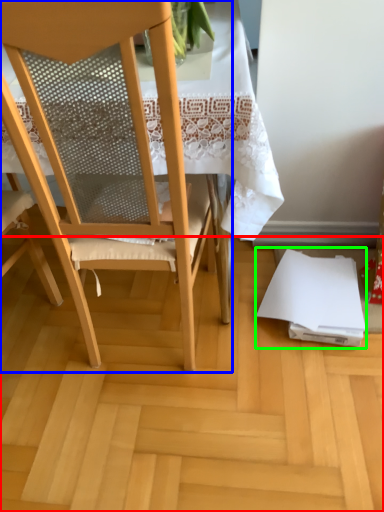
Question: Which is nearer to the plywood (highlighted by a red box)? chair (highlighted by a blue box) or notebook (highlighted by a green box).

Choices:
 (A) chair
 (B) notebook

Answer: (B)